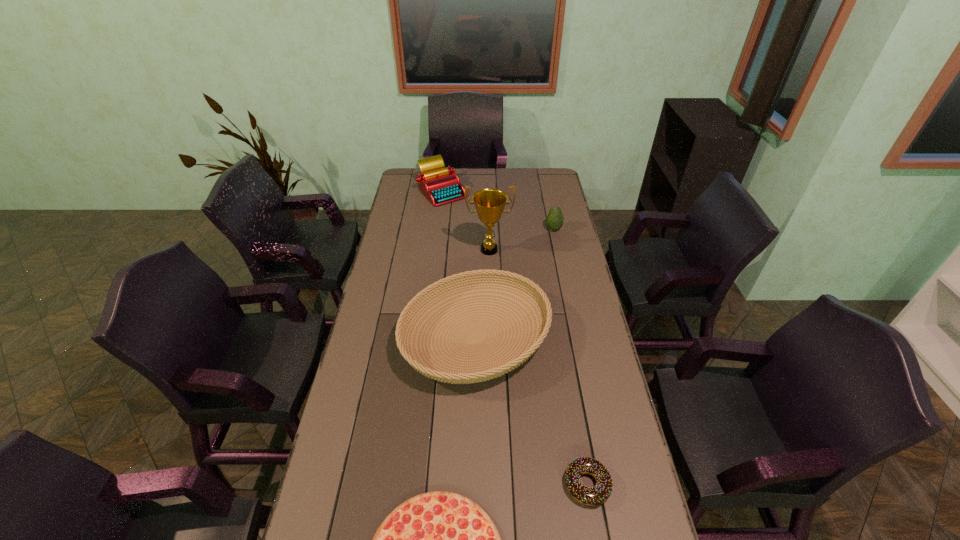
Where is `free location that satisfies the following two spatial constraints: 1. on the front view with handles of the doughnut; 2. on the right side of the third farthest object`? The image size is (960, 540). free location that satisfies the following two spatial constraints: 1. on the front view with handles of the doughnut; 2. on the right side of the third farthest object is located at coordinates (494, 484).

What are the coordinates of `free point that satisfies the following two spatial constraints: 1. on the typing side of the fourth farthest object; 2. on the left side of the typewriter` in the screenshot? It's located at (423, 338).

You are a GUI agent. You are given a task and a screenshot of the screen. Output one action in this format:
    pyautogui.click(x=<x>, y=<y>)
    Task: Click on the vacant space that satisfies the following two spatial constraints: 1. on the typing side of the farthest object; 2. on the right side of the avocado
    This screenshot has width=960, height=540.
    Given the screenshot: What is the action you would take?
    pyautogui.click(x=437, y=229)